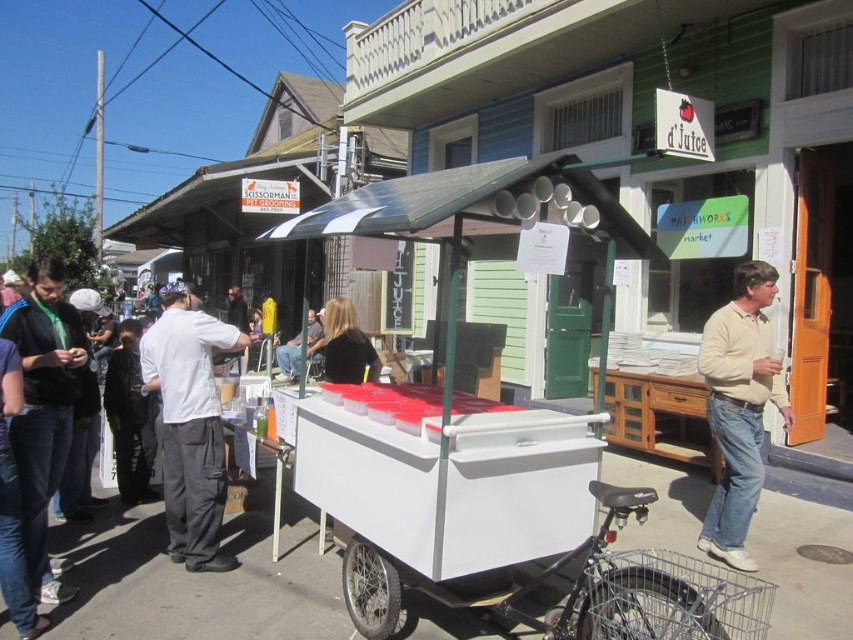
Question: Can you confirm if white cotton shirt at center is wider than light brown leather jacket at center?

Choices:
 (A) no
 (B) yes

Answer: (B)

Question: Which point is farther from the camera taking this photo?

Choices:
 (A) (294, 356)
 (B) (746, 300)
 (C) (44, 392)

Answer: (A)

Question: Which object is positioned farthest from the matte black jacket at left?

Choices:
 (A) light beige sweater at right
 (B) light brown leather jacket at center

Answer: (B)

Question: Is matte black jacket at left to the left of light brown leather jacket at center from the viewer's perspective?

Choices:
 (A) yes
 (B) no

Answer: (B)

Question: Considering the relative positions of light beige sweater at right and light brown leather jacket at center in the image provided, where is light beige sweater at right located with respect to light brown leather jacket at center?

Choices:
 (A) left
 (B) right

Answer: (B)

Question: Which point appears farthest from the camera in this image?

Choices:
 (A) (317, 328)
 (B) (51, 378)

Answer: (A)